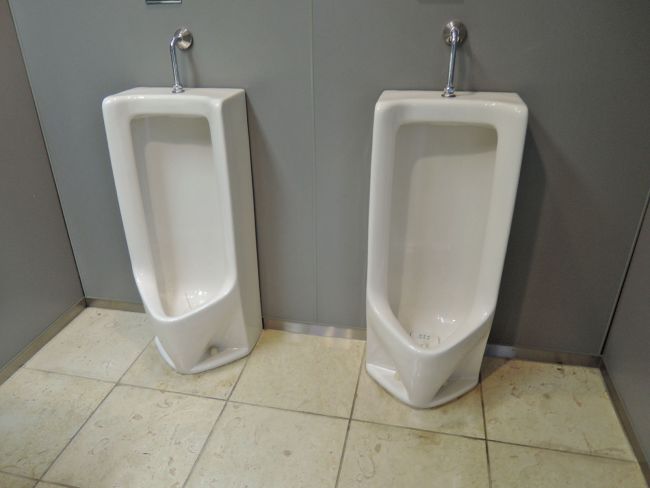
This screenshot has width=650, height=488. Find the location of `tile`. tile is located at coordinates (575, 479).